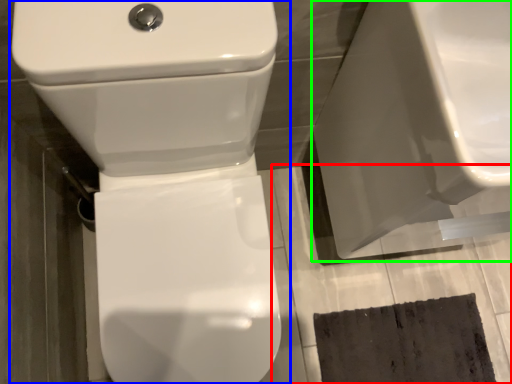
Question: Which object is positioned closest to concrete (highlighted by a red box)? Select from toilet (highlighted by a blue box) and porcelain (highlighted by a green box).

Choices:
 (A) toilet
 (B) porcelain

Answer: (B)